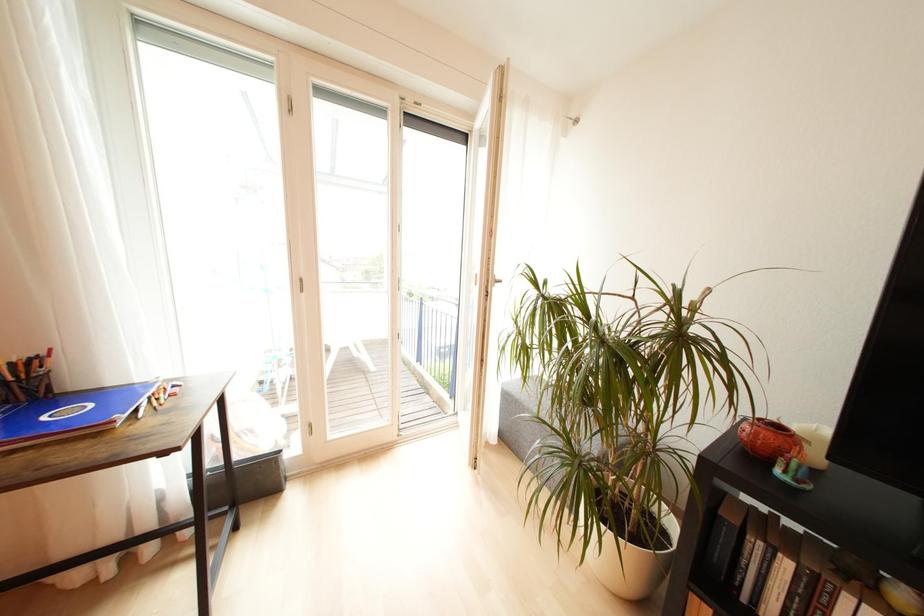
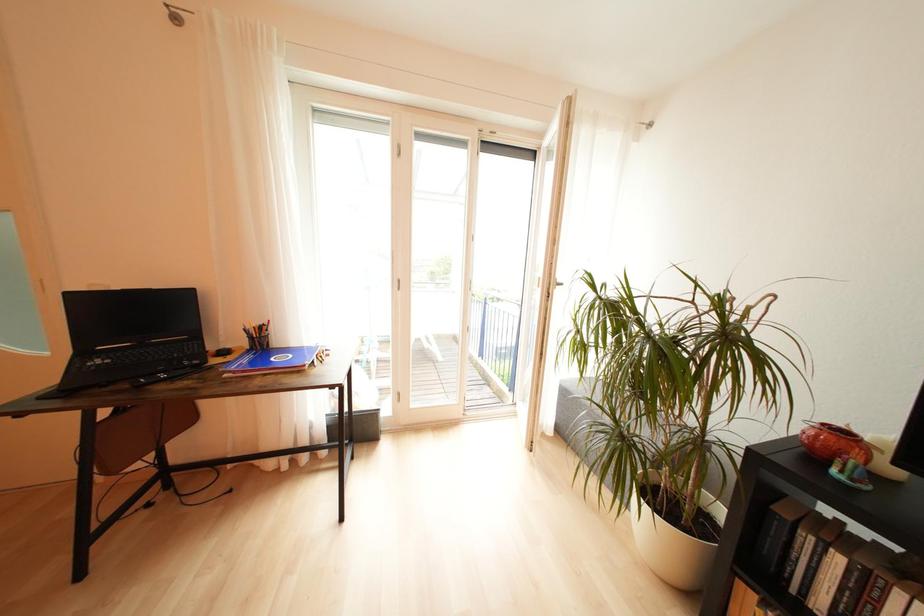
Question: The first image is from the beginning of the video and the second image is from the end. How did the camera likely rotate when shooting the video?

Choices:
 (A) Left
 (B) Right
 (C) Up
 (D) Down

Answer: (A)